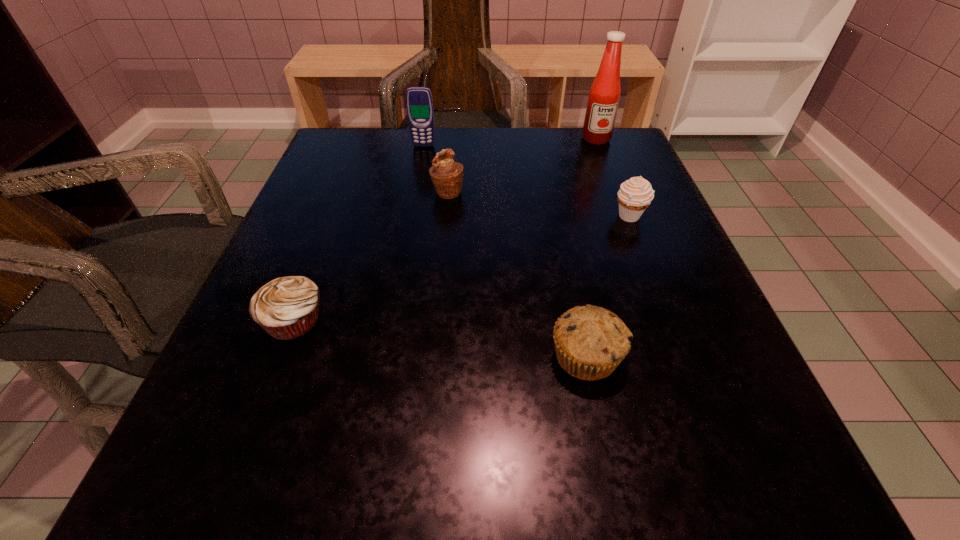
In the image, there is a desktop. At what (x,y) coordinates should I click in order to perform the action: click on free space at the far edge. Please return your answer as a coordinate pair (x, y). The width and height of the screenshot is (960, 540). Looking at the image, I should click on (541, 139).

In order to click on vacant space at the near edge in this screenshot , I will do `click(403, 505)`.

Where is `free region at the left edge`? This screenshot has width=960, height=540. free region at the left edge is located at coordinates (320, 187).

This screenshot has height=540, width=960. Find the location of `vacant space at the right edge`. vacant space at the right edge is located at coordinates (684, 265).

At what (x,y) coordinates should I click in order to perform the action: click on vacant space at the far left corner of the desktop. Please return your answer as a coordinate pair (x, y). Looking at the image, I should click on (396, 150).

You are a GUI agent. You are given a task and a screenshot of the screen. Output one action in this format:
    pyautogui.click(x=<x>, y=<y>)
    Task: Click on the vacant space at the near left corner of the desktop
    The image size is (960, 540).
    Given the screenshot: What is the action you would take?
    pyautogui.click(x=195, y=469)

Identify the location of free spot at the far right corner of the desktop. (588, 160).

At what (x,y) coordinates should I click in order to perform the action: click on vacant space in between the leftmost object and the fifth shortest object. Please return your answer as a coordinate pair (x, y). Image resolution: width=960 pixels, height=540 pixels. Looking at the image, I should click on (359, 233).

Where is `vacant area that lies between the fourth farthest object and the third muffin from right to left`? This screenshot has width=960, height=540. vacant area that lies between the fourth farthest object and the third muffin from right to left is located at coordinates (539, 205).

In order to click on free space between the tallest object and the second farthest muffin in this screenshot , I will do `click(612, 178)`.